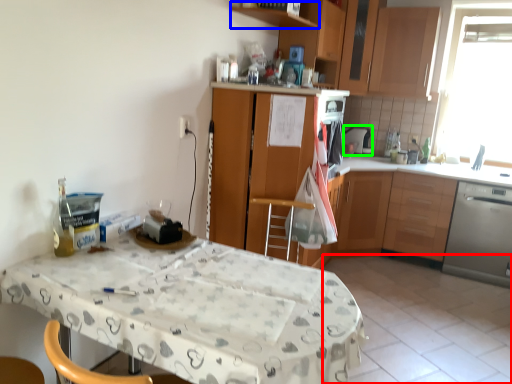
Question: Which is nearer to the tile (highlighted by a red box)? shelf (highlighted by a blue box) or appliance (highlighted by a green box).

Choices:
 (A) shelf
 (B) appliance

Answer: (B)